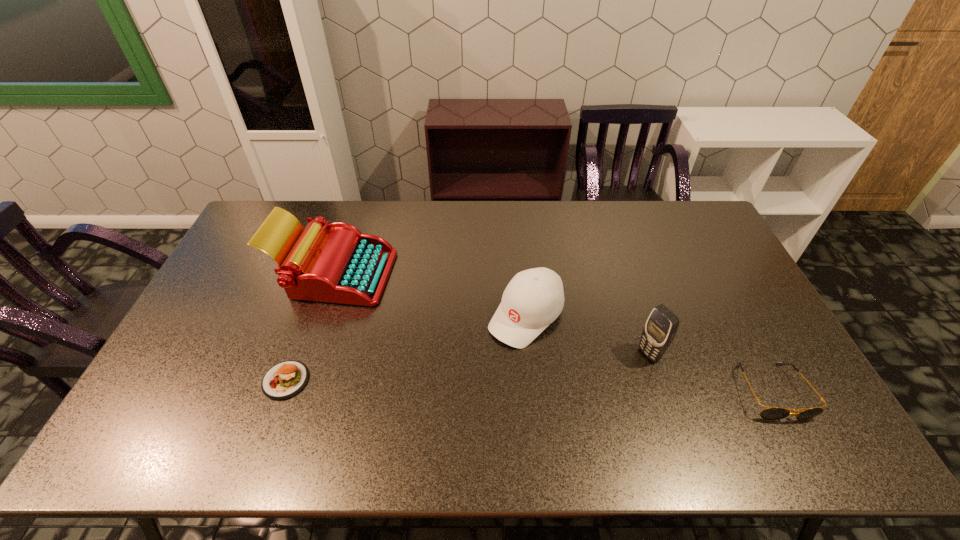
Where is `free spot between the shortest object and the rightmost object`? free spot between the shortest object and the rightmost object is located at coordinates (529, 386).

In order to click on unoccupied position between the fourth tallest object and the typewriter in this screenshot , I will do 554,332.

I want to click on free space between the cellular telephone and the sunglasses, so click(710, 373).

Where is `free space between the fourth object from left to right and the shortest object`? free space between the fourth object from left to right and the shortest object is located at coordinates (468, 367).

Where is `vacant point located between the rightmost object and the fourth object from left to right`? This screenshot has width=960, height=540. vacant point located between the rightmost object and the fourth object from left to right is located at coordinates (710, 373).

In order to click on vacant space in between the fourth object from left to right and the typewriter in this screenshot , I will do `click(492, 313)`.

Identify which object is the fourth closest to the typewriter. Please provide its 2D coordinates. Your answer should be formatted as a tuple, i.e. [(x, y)], where the tuple contains the x and y coordinates of a point satisfying the conditions above.

[(771, 413)]

The image size is (960, 540). Find the location of `the third closest object to the shortest object`. the third closest object to the shortest object is located at coordinates (661, 326).

This screenshot has height=540, width=960. Identify the location of vacant area that satisfies the following two spatial constraints: 1. on the back side of the shortest object; 2. on the right side of the typewriter. (324, 272).

Where is `vacant position in the image that satisfies the following two spatial constraints: 1. on the front side of the cellular telephone; 2. on the left side of the typewriter`? vacant position in the image that satisfies the following two spatial constraints: 1. on the front side of the cellular telephone; 2. on the left side of the typewriter is located at coordinates (308, 354).